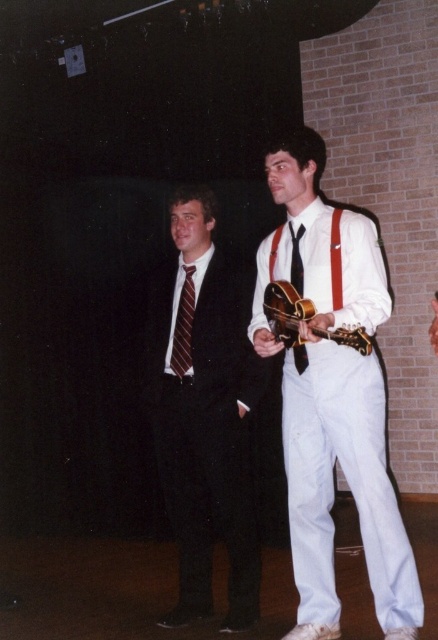
Is matte black suit at center closer to the viewer compared to glossy wood guitar at center?

No.

Which of these two, matte black suit at center or glossy wood guitar at center, stands taller?

With more height is matte black suit at center.

This screenshot has height=640, width=438. What do you see at coordinates (204, 417) in the screenshot?
I see `matte black suit at center` at bounding box center [204, 417].

Identify the location of matte black suit at center. This screenshot has width=438, height=640. coord(204,417).

Who is taller, white matte shirt at center or black leather belt at center?

With more height is white matte shirt at center.

Describe the element at coordinates (334, 397) in the screenshot. This screenshot has width=438, height=640. I see `white matte shirt at center` at that location.

Image resolution: width=438 pixels, height=640 pixels. What are the coordinates of `white matte shirt at center` in the screenshot? It's located at (334, 397).

Between point (186, 304) and point (184, 376), which one is positioned behind?

The point (186, 304) is behind.

The image size is (438, 640). Identify the location of striped fabric tie at center. (183, 326).

In order to click on striped fabric tie at center in this screenshot , I will do `click(183, 326)`.